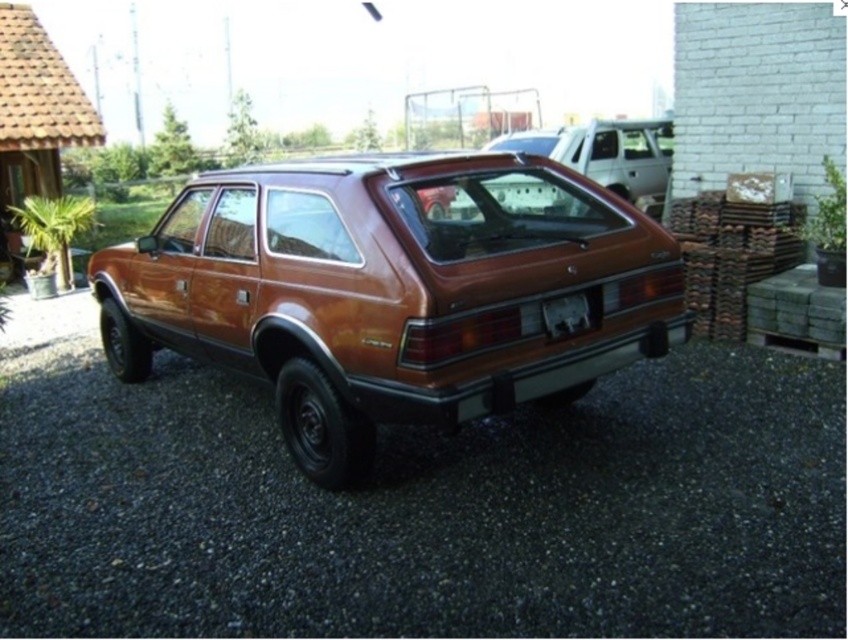
Question: Is smooth gravel at center smaller than satin gold car at center?

Choices:
 (A) yes
 (B) no

Answer: (A)

Question: Which point is closer to the camera?

Choices:
 (A) satin gold car at center
 (B) smooth gravel at center

Answer: (B)

Question: Can you confirm if smooth gravel at center is positioned below metallic silver suv at center?

Choices:
 (A) no
 (B) yes

Answer: (B)

Question: Does smooth gravel at center appear over metallic silver suv at center?

Choices:
 (A) yes
 (B) no

Answer: (B)

Question: Which of the following is the closest to the observer?

Choices:
 (A) (542, 138)
 (B) (555, 595)

Answer: (B)

Question: Among these points, which one is farthest from the camera?

Choices:
 (A) (696, 371)
 (B) (392, 228)
 (C) (594, 163)

Answer: (C)